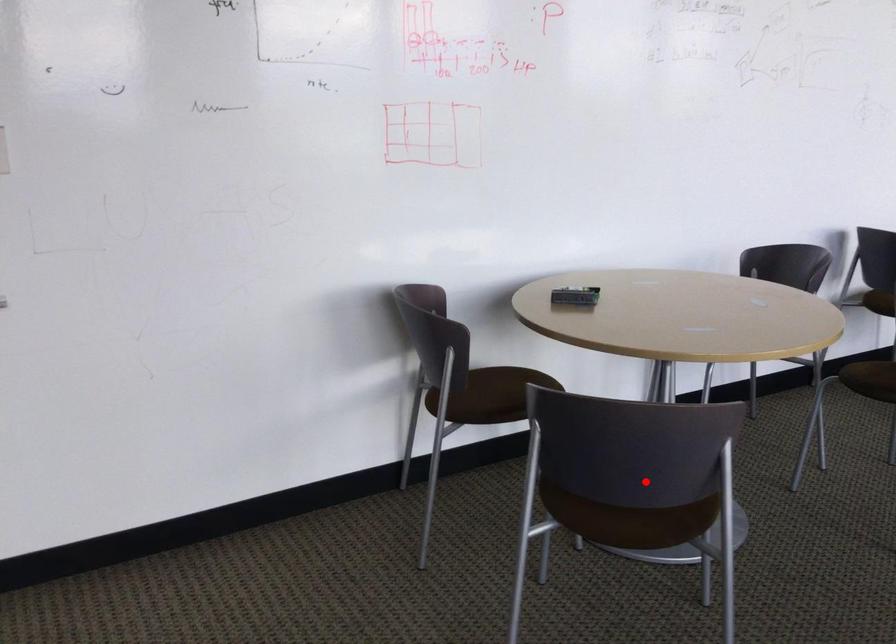
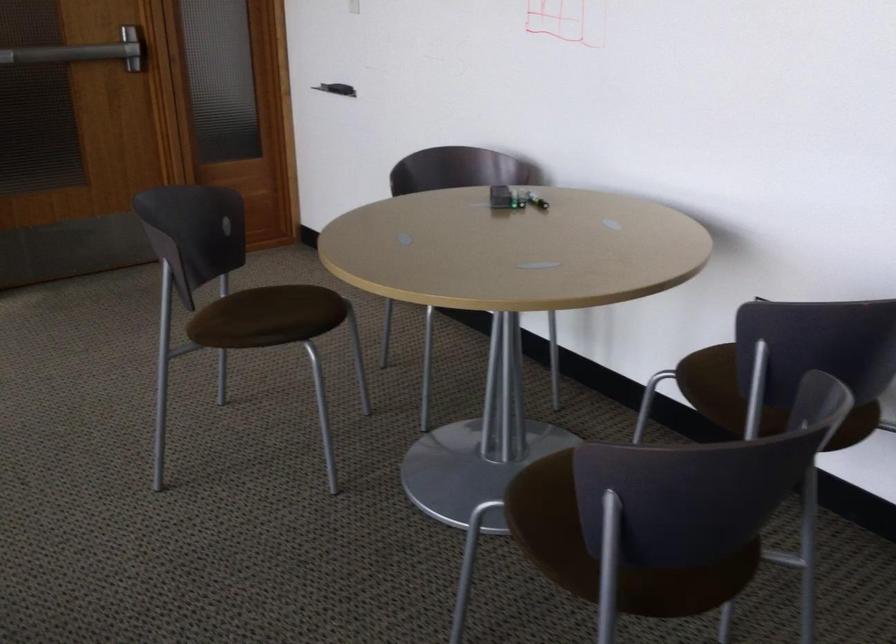
In the second image, find the point that corresponds to the highlighted location in the first image.

(276, 317)